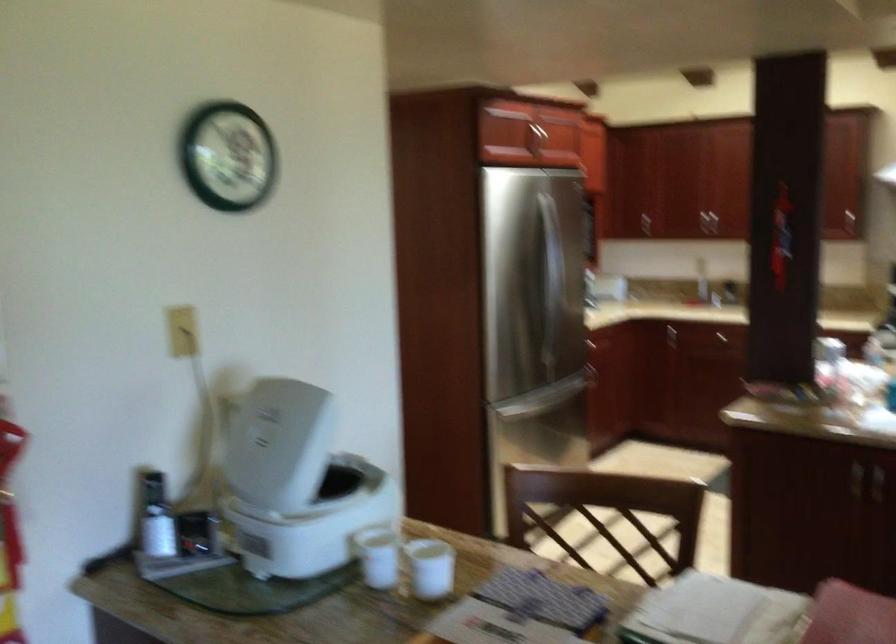
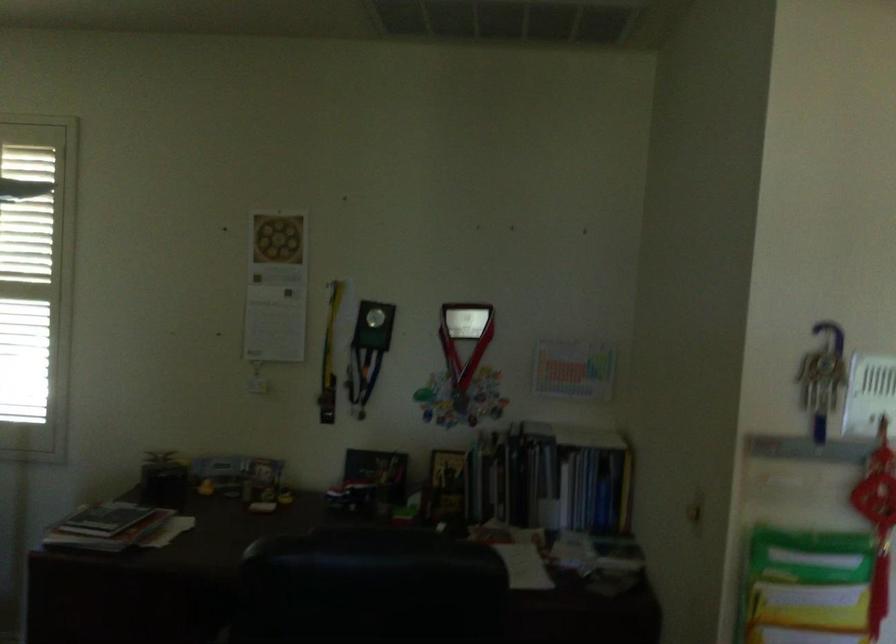
Question: The camera is either moving clockwise (left) or counter-clockwise (right) around the object. The first image is from the beginning of the video and the second image is from the end. Is the camera moving left or right when shooting the video?

Choices:
 (A) Left
 (B) Right

Answer: (B)